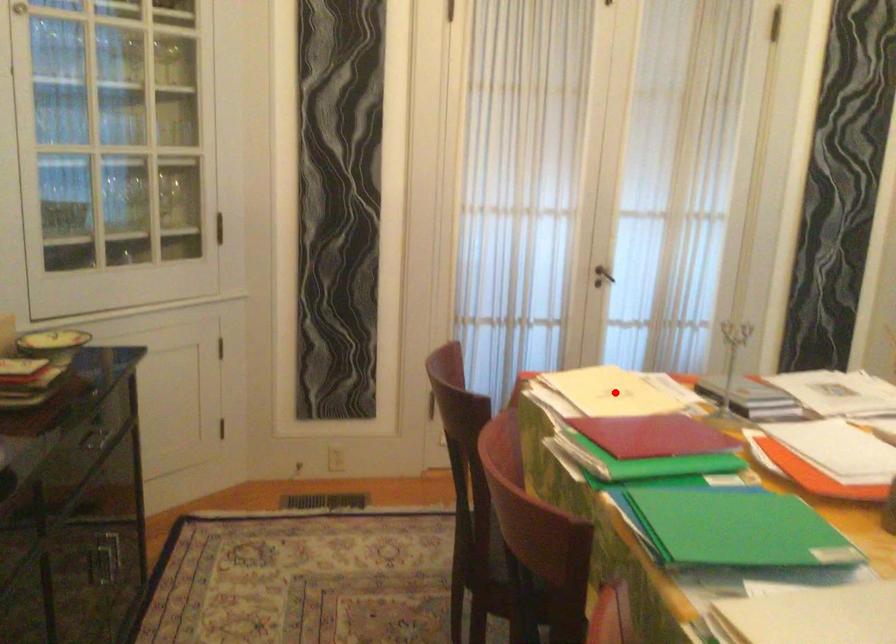
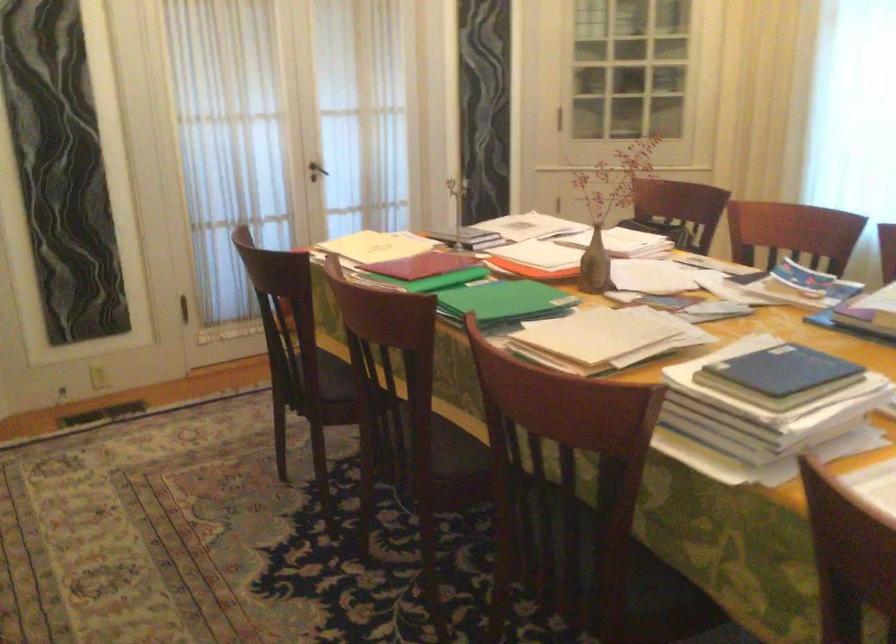
Locate, in the second image, the point that corresponds to the highlighted location in the first image.

(376, 245)